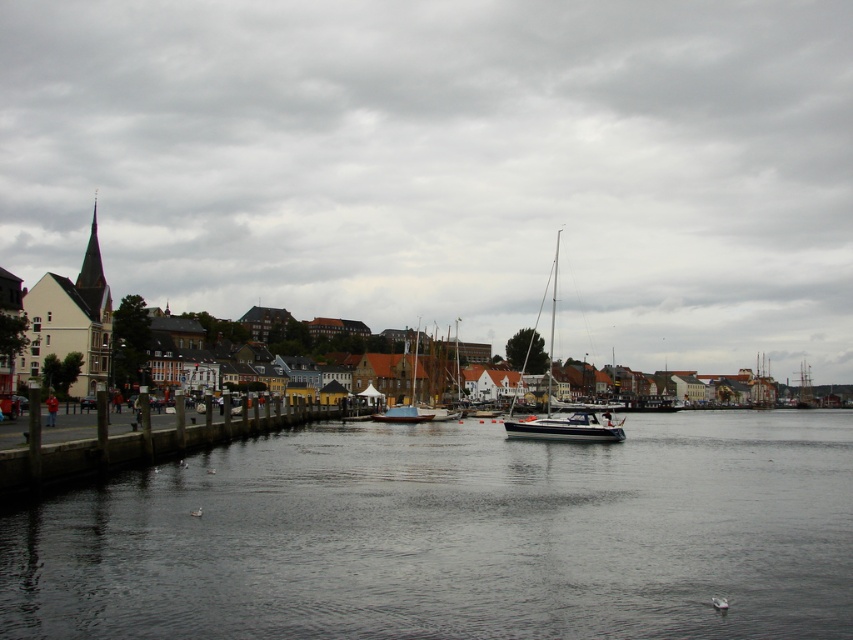
Question: Which point is closer to the camera?

Choices:
 (A) white glossy sailboat at center
 (B) white glossy boat at center
 (C) transparent water at center
 (D) cloudy sky at upper center

Answer: (C)

Question: Is white glossy sailboat at center to the left of white glossy boat at center from the viewer's perspective?

Choices:
 (A) no
 (B) yes

Answer: (A)

Question: Among these objects, which one is farthest from the camera?

Choices:
 (A) white glossy boat at center
 (B) white glossy sailboat at center

Answer: (B)

Question: Does white glossy sailboat at center have a greater width compared to white glossy boat at center?

Choices:
 (A) no
 (B) yes

Answer: (B)

Question: Which point is farther to the camera?

Choices:
 (A) (173, 438)
 (B) (50, 616)
 (C) (802, 145)

Answer: (C)

Question: Is white glossy sailboat at center bigger than white wooden sailboat at center?

Choices:
 (A) yes
 (B) no

Answer: (A)